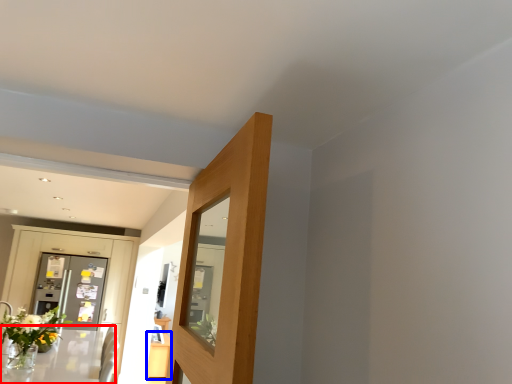
Question: Which object appears farthest to the camera in this image, table (highlighted by a red box) or table (highlighted by a blue box)?

Choices:
 (A) table
 (B) table

Answer: (B)